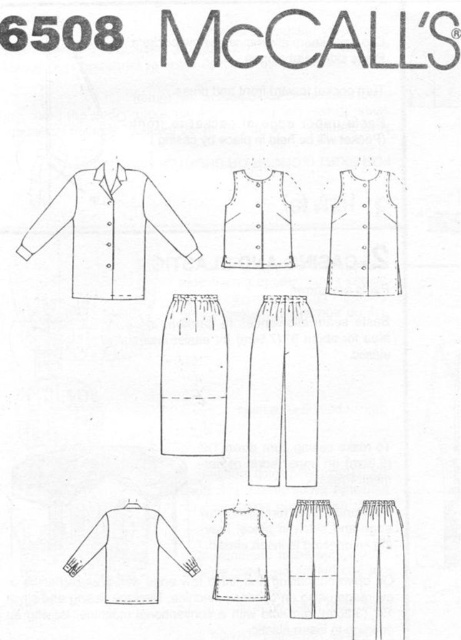
You are designing a layout for a catalog and need to arrange the matte white vest at upper center and the white cotton shirt at lower left. According to the spatial relationship between them, which object is positioned in front of the other?

The white cotton shirt at lower left is behind matte white vest at upper center, so the matte white vest at upper center is in front.

Consider the image. You are designing a layout for a sewing pattern catalog and need to place a new accessory icon next to the white cotton shirt at upper left. The accessory icon must be placed at least 10 cm away from the shirt. Where should you position the accessory icon to ensure it meets the requirement?

The white cotton shirt at upper left is located at point [108,228]. To place the accessory icon at least 10 cm away, you should position it beyond the coordinates that are 10 cm distant from this point in any direction.

You are a tailor looking at the McCalls sewing pattern 6508. You need to determine the placement of the white cotton shirt at lower left and the matte white vest at center. Which object is located to the left of the other?

The white cotton shirt at lower left is positioned on the left side of matte white vest at center.